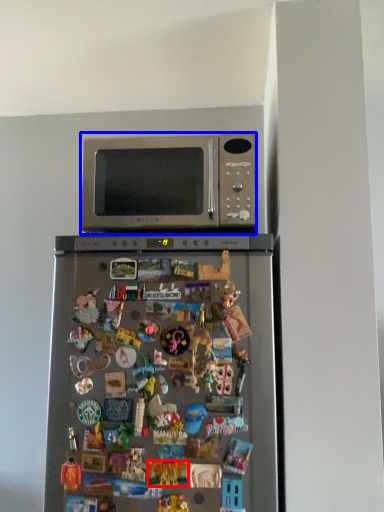
Question: Which object appears closest to the camera in this image, toy (highlighted by a red box) or microwave oven (highlighted by a blue box)?

Choices:
 (A) toy
 (B) microwave oven

Answer: (A)